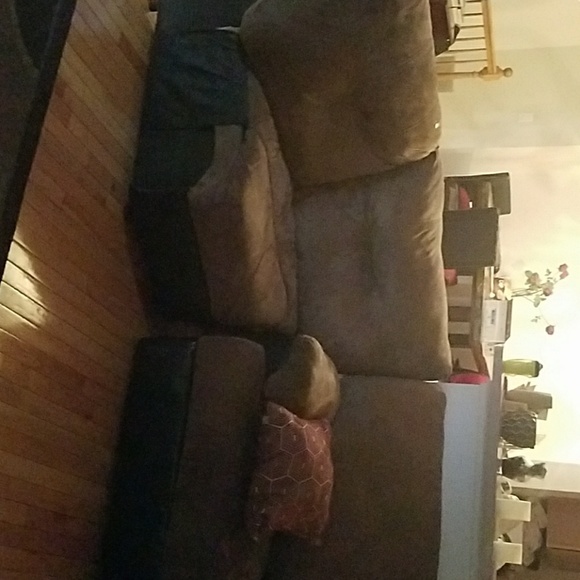
Identify the location of hand rail. (487, 28).